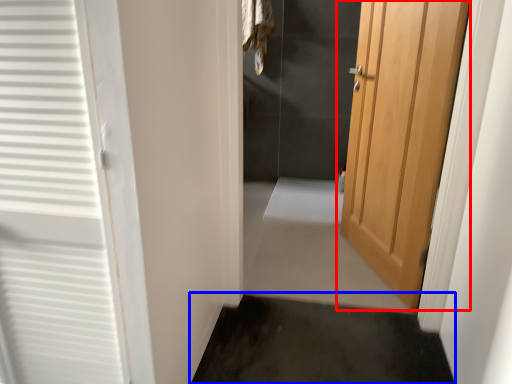
Question: Which point is further to the camera, door (highlighted by a red box) or path (highlighted by a blue box)?

Choices:
 (A) door
 (B) path

Answer: (A)